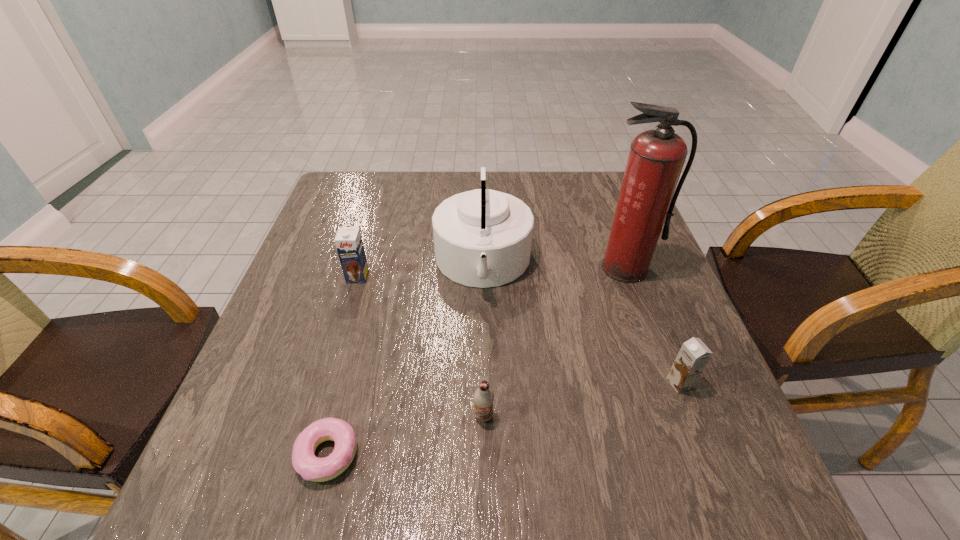
I want to click on free spot located 0.190m at the nozzle of the tallest object, so click(654, 347).

Find the location of a particular element. The height and width of the screenshot is (540, 960). vacant space situated on the spout of the second tallest object is located at coordinates (386, 264).

Identify the location of free point located on the spout of the second tallest object. (391, 264).

Find the location of a particular element. The height and width of the screenshot is (540, 960). blank space located 0.090m on the spout of the second tallest object is located at coordinates (398, 264).

The height and width of the screenshot is (540, 960). I want to click on free spot located 0.160m on the front label of the farthest chocolate milk, so click(340, 336).

The height and width of the screenshot is (540, 960). Identify the location of vacant area situated 0.250m on the left of the fourth farthest object. (538, 383).

Locate an element on the screen. Image resolution: width=960 pixels, height=540 pixels. free location located on the back of the second nearest object is located at coordinates (483, 266).

The width and height of the screenshot is (960, 540). I want to click on vacant space situated 0.320m on the right of the doughnut, so pyautogui.click(x=547, y=455).

Locate an element on the screen. object at the near edge is located at coordinates (305, 463).

Identify the location of chocolate milk that is at the left edge. (348, 241).